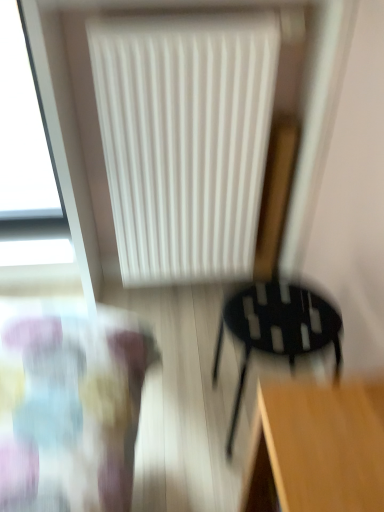
The width and height of the screenshot is (384, 512). Describe the element at coordinates (185, 141) in the screenshot. I see `white matte radiator at upper center` at that location.

What is the approximate height of white matte radiator at upper center?

It is 36.63 inches.

The height and width of the screenshot is (512, 384). Identify the location of white matte radiator at upper center. (185, 141).

The image size is (384, 512). What do you see at coordinates (276, 283) in the screenshot?
I see `black matte chair at lower right` at bounding box center [276, 283].

This screenshot has height=512, width=384. What are the coordinates of `black matte chair at lower right` in the screenshot? It's located at (276, 283).

Locate an element on the screen. Image resolution: width=384 pixels, height=512 pixels. white matte radiator at upper center is located at coordinates (185, 141).

Is black matte chair at lower right at the left side of white matte radiator at upper center?

No, black matte chair at lower right is not to the left of white matte radiator at upper center.

In the image, is black matte chair at lower right positioned in front of or behind white matte radiator at upper center?

black matte chair at lower right is in front of white matte radiator at upper center.

Which is farther, (291, 180) or (261, 38)?

Point (291, 180)

From the image's perspective, who appears lower, black matte chair at lower right or white matte radiator at upper center?

black matte chair at lower right.

From a real-world perspective, who is located higher, black matte chair at lower right or white matte radiator at upper center?

white matte radiator at upper center, from a real-world perspective.

Does black matte chair at lower right have a lesser width compared to white matte radiator at upper center?

Incorrect, the width of black matte chair at lower right is not less than that of white matte radiator at upper center.

From their relative heights in the image, would you say black matte chair at lower right is taller or shorter than white matte radiator at upper center?

black matte chair at lower right is shorter than white matte radiator at upper center.

Who is smaller, black matte chair at lower right or white matte radiator at upper center?

black matte chair at lower right.

Would you say black matte chair at lower right contains white matte radiator at upper center?

Actually, white matte radiator at upper center is outside black matte chair at lower right.

Would you say black matte chair at lower right is a long distance from white matte radiator at upper center?

That's not correct — black matte chair at lower right is a little close to white matte radiator at upper center.

Consider the image. Is black matte chair at lower right oriented towards white matte radiator at upper center?

No, black matte chair at lower right does not turn towards white matte radiator at upper center.

What's the angular difference between black matte chair at lower right and white matte radiator at upper center's facing directions?

They differ by 85.7 degrees in their facing directions.

At what (x,y) coordinates should I click in order to perform the action: click on radiator behind the black matte chair at lower right. Please return your answer as a coordinate pair (x, y). Image resolution: width=384 pixels, height=512 pixels. Looking at the image, I should click on (185, 141).

Is white matte radiator at upper center at the right side of black matte chair at lower right?

No.

Which is behind, white matte radiator at upper center or black matte chair at lower right?

white matte radiator at upper center is further from the camera.

Does point (180, 31) come in front of point (309, 325)?

No, it is behind (309, 325).

From the image's perspective, is white matte radiator at upper center below black matte chair at lower right?

Actually, white matte radiator at upper center appears above black matte chair at lower right in the image.

From a real-world perspective, is white matte radiator at upper center over black matte chair at lower right?

Correct, in the physical world, white matte radiator at upper center is higher than black matte chair at lower right.

Does white matte radiator at upper center have a greater width compared to black matte chair at lower right?

No, white matte radiator at upper center is not wider than black matte chair at lower right.

Can you confirm if white matte radiator at upper center is taller than black matte chair at lower right?

Indeed, white matte radiator at upper center has a greater height compared to black matte chair at lower right.

Does white matte radiator at upper center have a smaller size compared to black matte chair at lower right?

No.

Is white matte radiator at upper center inside the boundaries of black matte chair at lower right, or outside?

white matte radiator at upper center is not inside black matte chair at lower right, it's outside.

Are white matte radiator at upper center and black matte chair at lower right located far from each other?

No, white matte radiator at upper center is in close proximity to black matte chair at lower right.

Could you tell me if white matte radiator at upper center is facing black matte chair at lower right?

Yes.

What's the angular difference between white matte radiator at upper center and black matte chair at lower right's facing directions?

85.7 degrees.

Measure the distance from white matte radiator at upper center to black matte chair at lower right.

white matte radiator at upper center is 20.68 inches from black matte chair at lower right.

Find the location of `chair in front of the white matte radiator at upper center`. chair in front of the white matte radiator at upper center is located at coordinates (276, 283).

This screenshot has height=512, width=384. What are the coordinates of `chair below the white matte radiator at upper center (from the image's perspective)` in the screenshot? It's located at (276, 283).

Where is `radiator above the black matte chair at lower right (from a real-world perspective)`? The width and height of the screenshot is (384, 512). radiator above the black matte chair at lower right (from a real-world perspective) is located at coordinates point(185,141).